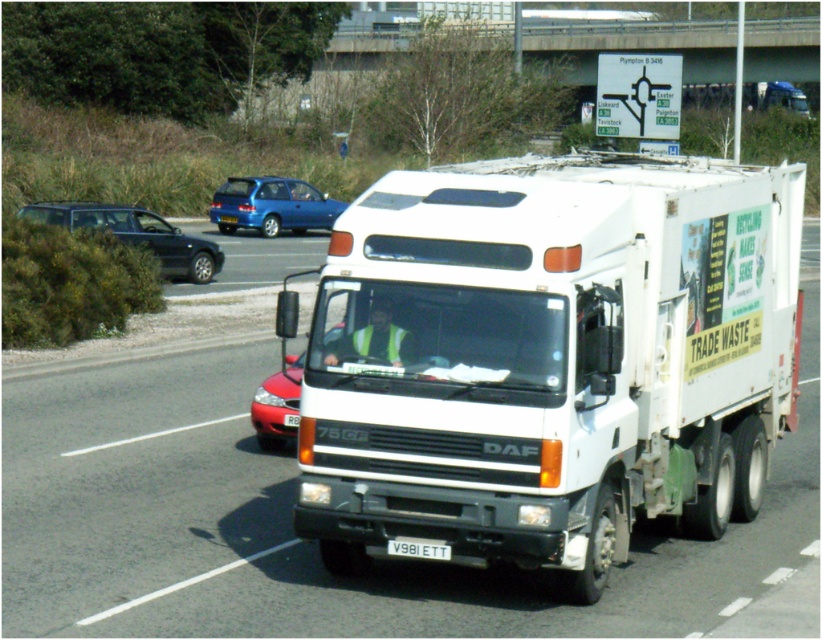
Can you confirm if metallic blue hatchback at upper center is positioned to the left of shiny red sedan at center?

Correct, you'll find metallic blue hatchback at upper center to the left of shiny red sedan at center.

Who is positioned more to the right, metallic blue hatchback at upper center or shiny red sedan at center?

Positioned to the right is shiny red sedan at center.

The height and width of the screenshot is (640, 822). I want to click on metallic blue hatchback at upper center, so click(x=271, y=205).

Find the location of a particular element. Image resolution: width=822 pixels, height=640 pixels. metallic blue hatchback at upper center is located at coordinates (271, 205).

Can you confirm if white matte truck at center is positioned to the right of white plastic license plate at center?

No, white matte truck at center is not to the right of white plastic license plate at center.

Is point (538, 484) in front of point (419, 545)?

Yes, it is in front of point (419, 545).

Describe the element at coordinates (548, 358) in the screenshot. This screenshot has width=822, height=640. I see `white matte truck at center` at that location.

Locate an element on the screen. The width and height of the screenshot is (822, 640). white matte truck at center is located at coordinates (548, 358).

Does point (606, 396) come farther from viewer compared to point (105, 205)?

No, it is not.

Which is more to the right, white matte truck at center or shiny black sedan at left?

Positioned to the right is white matte truck at center.

Find the location of a particular element. The width and height of the screenshot is (822, 640). white matte truck at center is located at coordinates (548, 358).